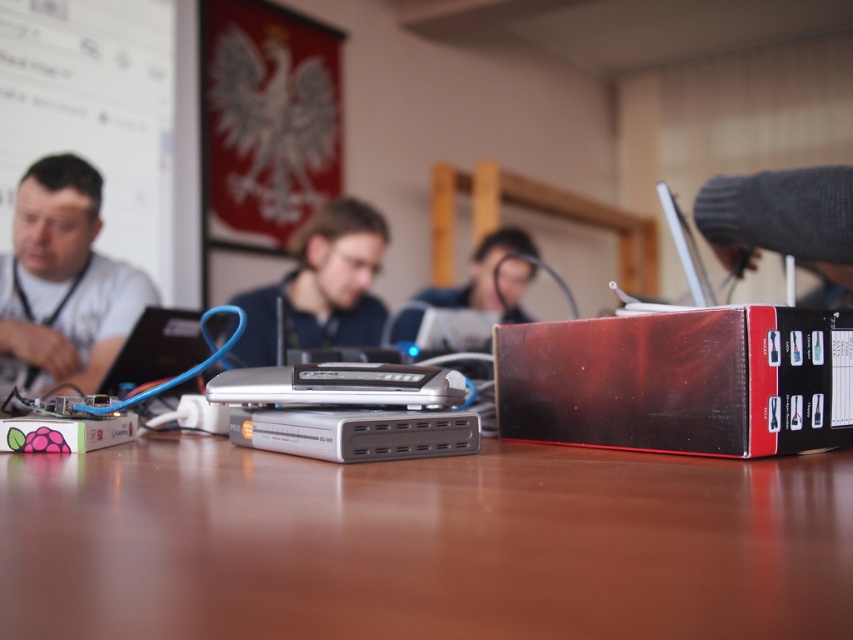
Question: Which object is positioned closest to the matte black router at center?

Choices:
 (A) gray knitted sweater at upper right
 (B) white matte shirt at left

Answer: (B)

Question: Is brown wooden table at center bigger than gray knitted sweater at upper right?

Choices:
 (A) yes
 (B) no

Answer: (A)

Question: Can you confirm if matte black router at center is positioned above gray knitted sweater at upper right?

Choices:
 (A) no
 (B) yes

Answer: (B)

Question: Based on their relative distances, which object is farther from the smooth plastic face at center?

Choices:
 (A) matte black router at center
 (B) brown wooden table at center
 (C) white matte shirt at left

Answer: (B)

Question: Is matte black router at center below gray knitted sweater at upper right?

Choices:
 (A) yes
 (B) no

Answer: (B)

Question: Among these points, which one is nearest to the camera?

Choices:
 (A) (608, 608)
 (B) (527, 320)
 (C) (763, 177)

Answer: (A)